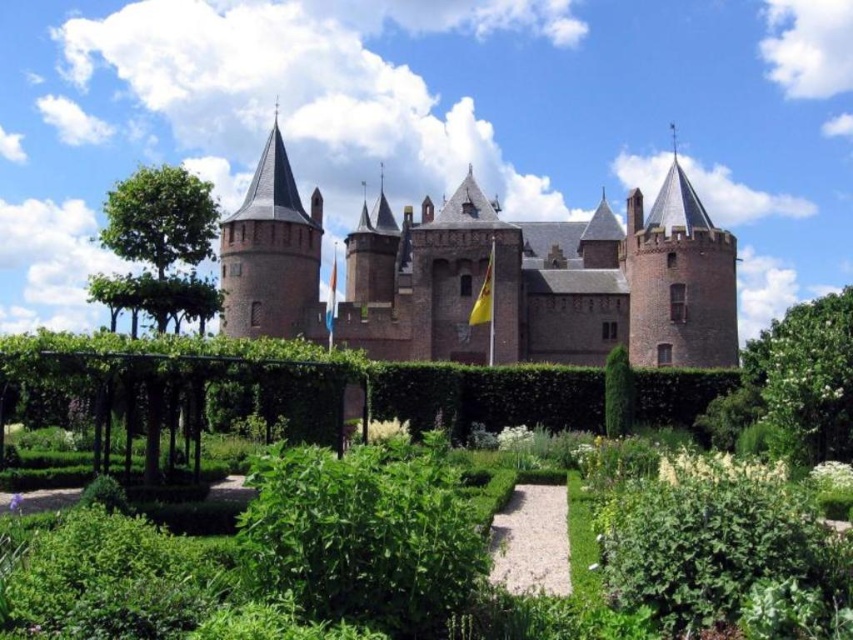
Question: From the image, what is the correct spatial relationship of green leafy hedge at lower center in relation to green leafy bush at right?

Choices:
 (A) left
 (B) right

Answer: (A)

Question: Which object is closer to the camera taking this photo?

Choices:
 (A) green leafy tree at left
 (B) green leafy hedge at center
 (C) brick tower at center-left

Answer: (B)

Question: Is green leafy hedge at lower center behind green leafy tree at left?

Choices:
 (A) yes
 (B) no

Answer: (B)

Question: From the image, what is the correct spatial relationship of green leafy hedge at lower center in relation to green leafy hedge at center?

Choices:
 (A) above
 (B) below

Answer: (B)

Question: Which point is closer to the camera?

Choices:
 (A) (140, 204)
 (B) (212, 371)
 (C) (314, 234)

Answer: (B)

Question: Based on their relative distances, which object is farther from the green leafy hedge at center?

Choices:
 (A) brick tower at center-left
 (B) green leafy tree at left
 (C) green leafy bush at right
 (D) green leafy hedge at lower center

Answer: (A)